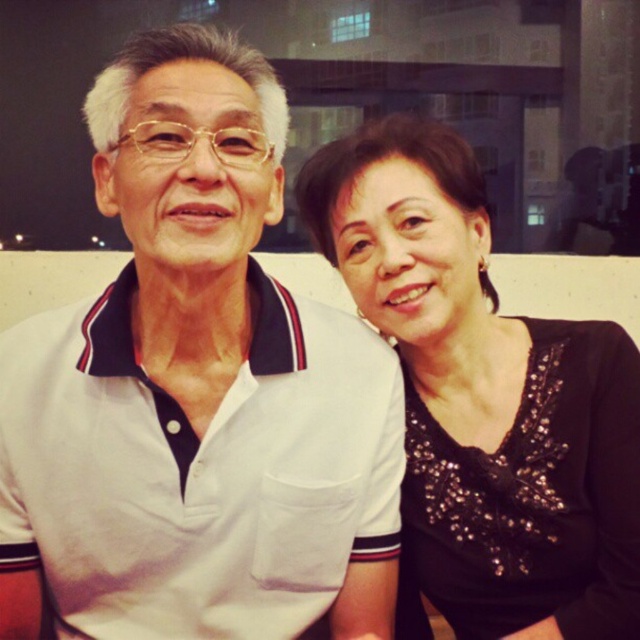
Does white cotton polo shirt at center have a smaller size compared to black sequined blouse at right?

No.

Is white cotton polo shirt at center further to the viewer compared to black sequined blouse at right?

No, white cotton polo shirt at center is closer to the viewer.

Who is more distant from viewer, [269,291] or [566,380]?

Point [566,380]

The image size is (640, 640). What are the coordinates of `white cotton polo shirt at center` in the screenshot? It's located at (196, 392).